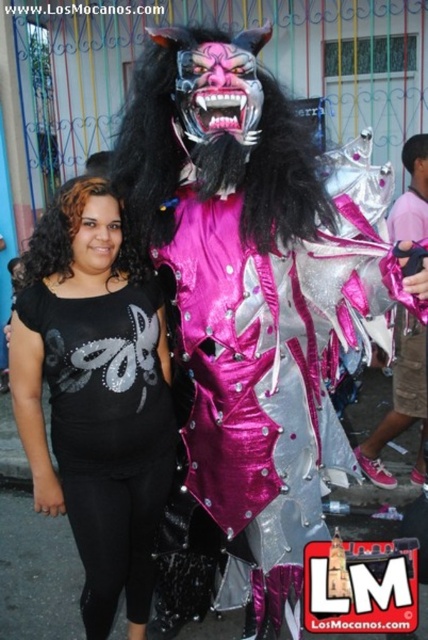
Question: Does black matte leggings at lower left have a larger size compared to shiny silver costume at right?

Choices:
 (A) no
 (B) yes

Answer: (A)

Question: Can you confirm if black matte leggings at lower left is positioned to the left of shiny silver costume at right?

Choices:
 (A) yes
 (B) no

Answer: (A)

Question: Which of the following is the farthest from the observer?

Choices:
 (A) shiny silver costume at right
 (B) black matte leggings at lower left

Answer: (A)

Question: In this image, where is black matte leggings at lower left located relative to shiny silver costume at right?

Choices:
 (A) right
 (B) left

Answer: (B)